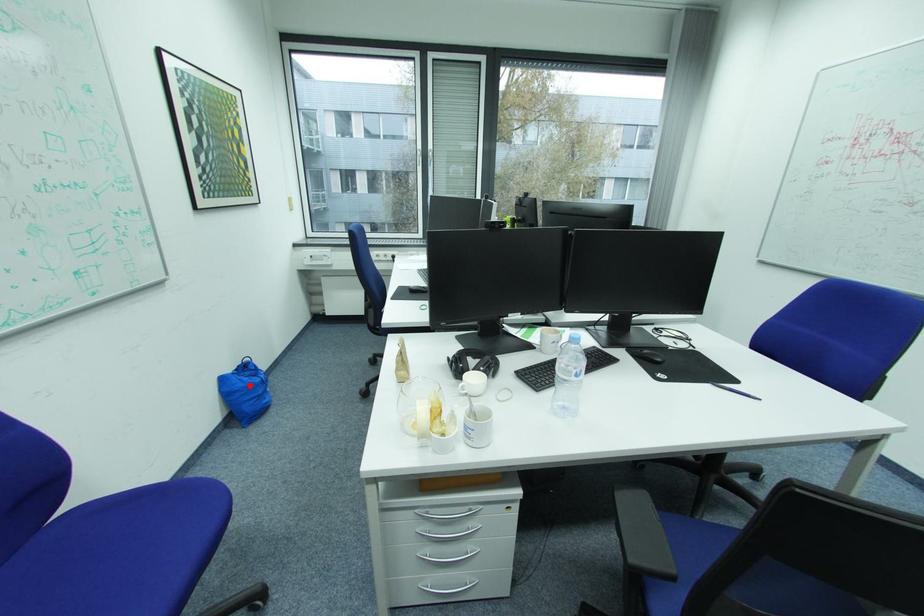
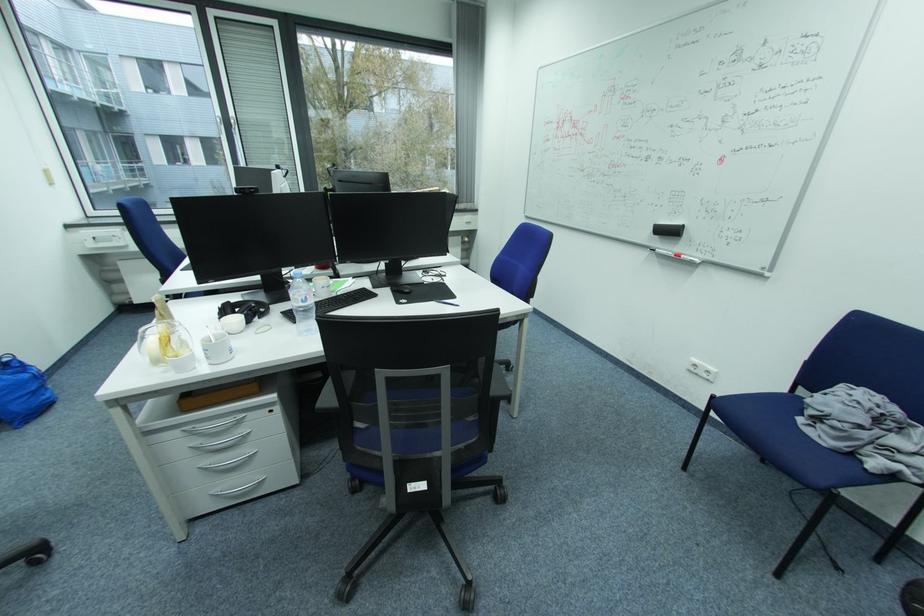
Find the pixel in the second image that matches the highlighted location in the first image.

(9, 385)